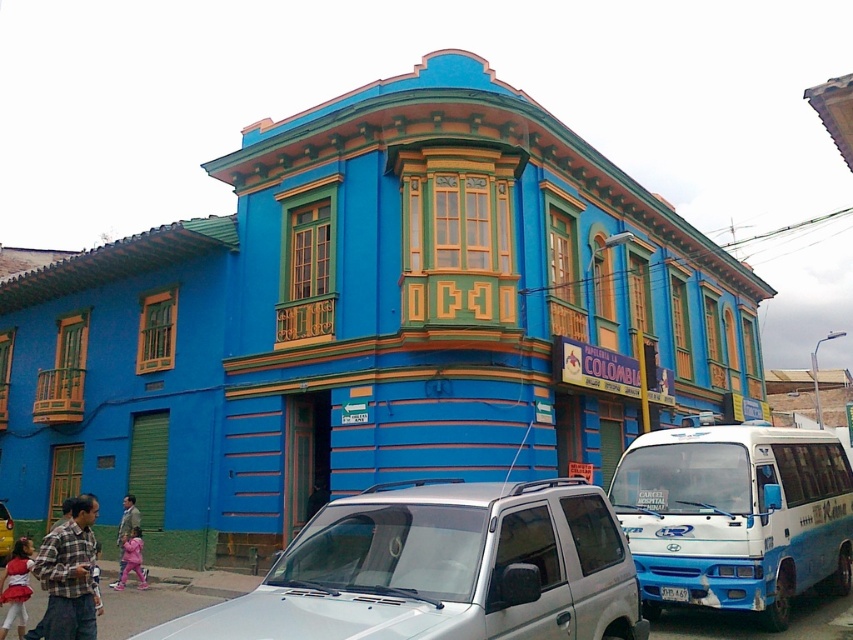
Can you confirm if silver metallic suv at center is positioned to the right of metallic silver suv at center?

Correct, you'll find silver metallic suv at center to the right of metallic silver suv at center.

Who is more forward, (515, 625) or (9, 531)?

Positioned in front is point (515, 625).

This screenshot has width=853, height=640. Identify the location of silver metallic suv at center. (440, 570).

Can you confirm if matte red dress at lower left is positioned below matte pink dress at lower left?

Incorrect, matte red dress at lower left is not positioned below matte pink dress at lower left.

Which is more to the left, matte red dress at lower left or matte pink dress at lower left?

Positioned to the left is matte pink dress at lower left.

This screenshot has width=853, height=640. I want to click on matte red dress at lower left, so click(16, 586).

How far apart are plaid fabric shirt at lower left and matte red dress at lower left?

6.68 feet

Which is in front, point (96, 500) or point (22, 593)?

Positioned in front is point (96, 500).

At what (x,y) coordinates should I click in order to perform the action: click on plaid fabric shirt at lower left. Please return your answer as a coordinate pair (x, y). The width and height of the screenshot is (853, 640). Looking at the image, I should click on (68, 576).